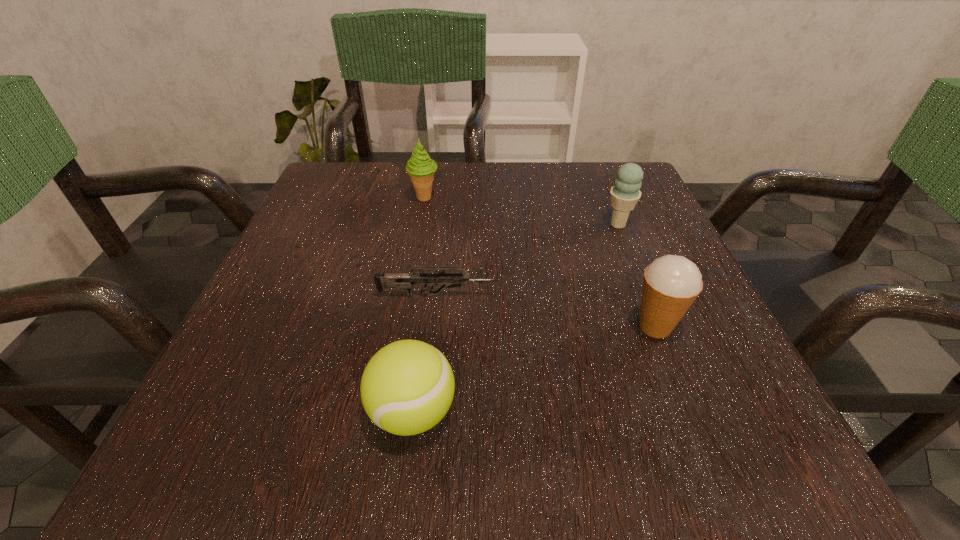
Where is `the leftmost icecream`? The height and width of the screenshot is (540, 960). the leftmost icecream is located at coordinates (420, 167).

At what (x,y) coordinates should I click in order to perform the action: click on the farthest icecream. Please return your answer as a coordinate pair (x, y). The width and height of the screenshot is (960, 540). Looking at the image, I should click on click(x=420, y=167).

Image resolution: width=960 pixels, height=540 pixels. I want to click on the fourth nearest object, so click(626, 193).

You are a GUI agent. You are given a task and a screenshot of the screen. Output one action in this format:
    pyautogui.click(x=<x>, y=<y>)
    Task: Click on the nearest icecream
    The width and height of the screenshot is (960, 540).
    Given the screenshot: What is the action you would take?
    pyautogui.click(x=671, y=284)

I want to click on the second shortest object, so click(407, 387).

At what (x,y) coordinates should I click in order to perform the action: click on the nearest object. Please return your answer as a coordinate pair (x, y). This screenshot has width=960, height=540. Looking at the image, I should click on (407, 387).

At what (x,y) coordinates should I click in order to perform the action: click on the shortest object. Please return your answer as a coordinate pair (x, y). Image resolution: width=960 pixels, height=540 pixels. Looking at the image, I should click on (404, 281).

I want to click on gun, so click(x=404, y=281).

Image resolution: width=960 pixels, height=540 pixels. In order to click on vacant area situated on the front of the farthest object in this screenshot , I will do `click(396, 356)`.

Image resolution: width=960 pixels, height=540 pixels. In order to click on free space located on the left of the second farthest icecream in this screenshot , I will do `click(435, 225)`.